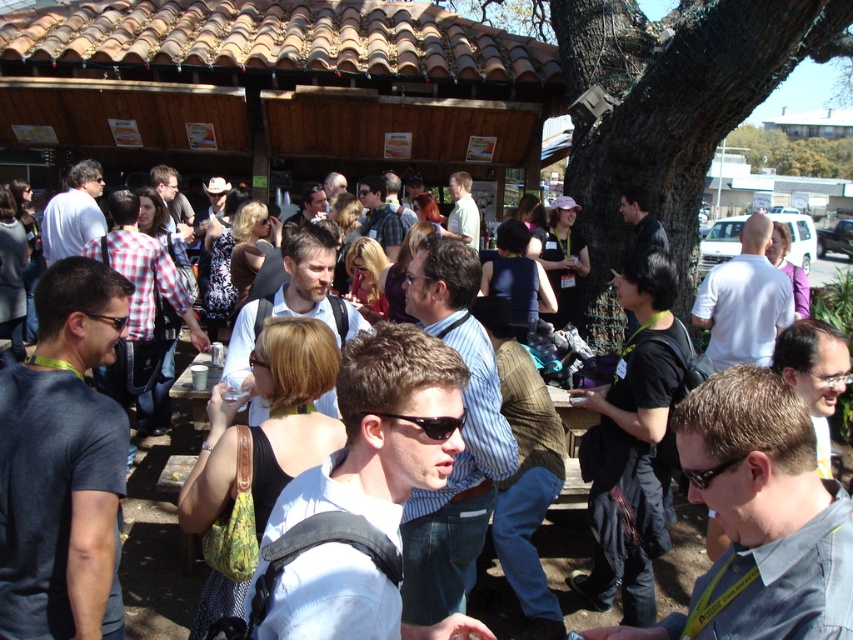
Question: Which object appears farthest from the camera in this image?

Choices:
 (A) blue striped shirt at center
 (B) white cotton shirt at center
 (C) light brown hair at center
 (D) white matte shirt at center

Answer: (C)

Question: Is white matte shirt at center smaller than black fabric backpack at center?

Choices:
 (A) no
 (B) yes

Answer: (B)

Question: Which point appears closest to the camera in this image?

Choices:
 (A) (451, 188)
 (B) (280, 634)
 (C) (91, 161)
 (D) (755, 225)

Answer: (B)

Question: Is white matte shirt at center below black fabric backpack at center?

Choices:
 (A) yes
 (B) no

Answer: (B)

Question: Estimate the real-world distances between objects in this image. Which object is farther from the denim shirt at center?

Choices:
 (A) blue striped shirt at center
 (B) light brown hair at center
 (C) matte blue shirt at center
 (D) matte black shirt at center

Answer: (D)

Question: Where is white matte shirt at center located in relation to black fabric backpack at center in the image?

Choices:
 (A) above
 (B) below

Answer: (A)